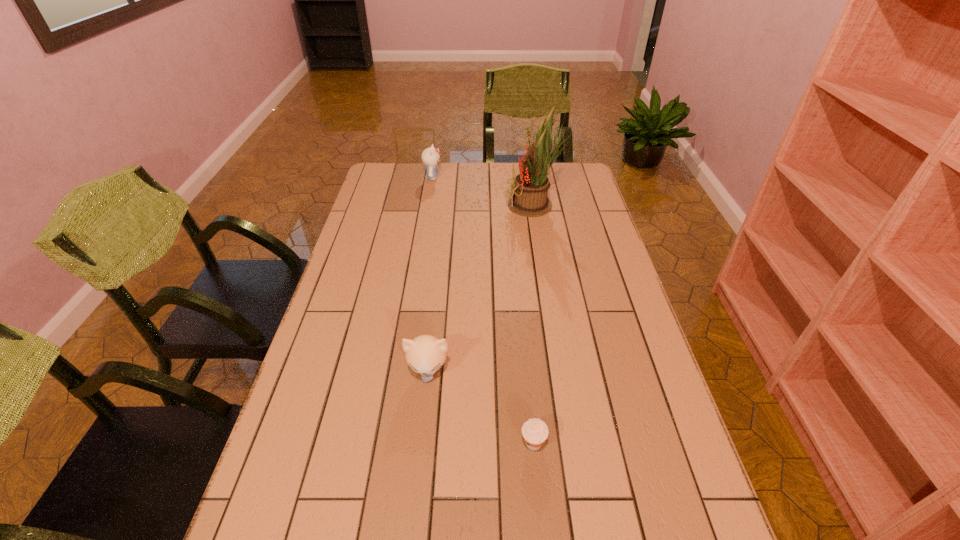
You are a GUI agent. You are given a task and a screenshot of the screen. Output one action in this format:
    pyautogui.click(x=<x>, y=<y>)
    Task: Click on the empty space that is in between the nearest object and the third farthest object
    This screenshot has width=960, height=540.
    Given the screenshot: What is the action you would take?
    pyautogui.click(x=481, y=407)

Locate an element on the screen. vacant region between the second farthest object and the muffin is located at coordinates (535, 324).

This screenshot has height=540, width=960. I want to click on free space between the nearer kitten and the third nearest object, so click(x=482, y=288).

The height and width of the screenshot is (540, 960). Identify the location of unoccupied position between the nearer kitten and the farthest object. (430, 274).

Locate an element on the screen. This screenshot has width=960, height=540. free space between the muffin and the flower arrangement is located at coordinates [x=535, y=324].

What are the coordinates of `unoccupied area between the nearer kitten and the tallest object` in the screenshot? It's located at (482, 288).

I want to click on empty space that is in between the nearest object and the farthest object, so click(x=483, y=310).

You are a GUI agent. You are given a task and a screenshot of the screen. Output one action in this format:
    pyautogui.click(x=<x>, y=<y>)
    Task: Click on the free spot between the farther kitten and the flower arrangement
    Image resolution: width=960 pixels, height=540 pixels.
    Given the screenshot: What is the action you would take?
    pyautogui.click(x=484, y=192)

Locate an element on the screen. unoccupied area between the flower arrangement and the farthest object is located at coordinates (484, 192).

I want to click on vacant space that is in between the flower arrangement and the farthest object, so click(484, 192).